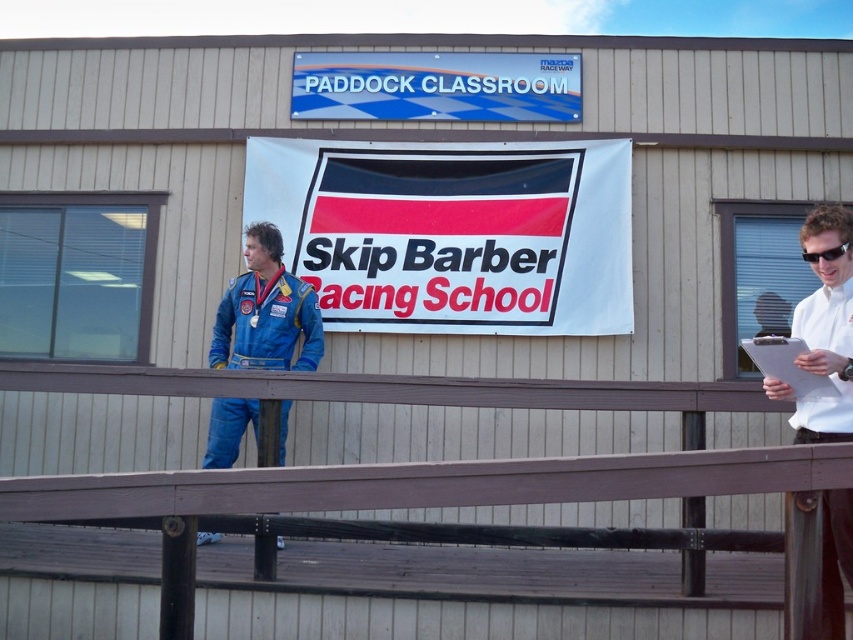
Question: In this image, where is white fabric banner at center located relative to white paper clipboard at right?

Choices:
 (A) above
 (B) below

Answer: (A)

Question: Can you confirm if white fabric banner at center is smaller than black plastic goggles at upper right?

Choices:
 (A) yes
 (B) no

Answer: (B)

Question: Which object is positioned farthest from the white paper clipboard at right?

Choices:
 (A) white fabric banner at center
 (B) faded denim jacket at lower left
 (C) white shirt at upper right
 (D) black plastic goggles at upper right

Answer: (B)

Question: Which point is farther from the camera taking this photo?

Choices:
 (A) (260, 317)
 (B) (821, 376)
 (C) (831, 369)
 (D) (843, 244)

Answer: (A)

Question: Among these points, which one is nearest to the camera?

Choices:
 (A) (845, 497)
 (B) (827, 378)
 (C) (839, 244)

Answer: (B)

Question: Where is faded denim jacket at lower left located in relation to white paper clipboard at right in the image?

Choices:
 (A) below
 (B) above

Answer: (A)